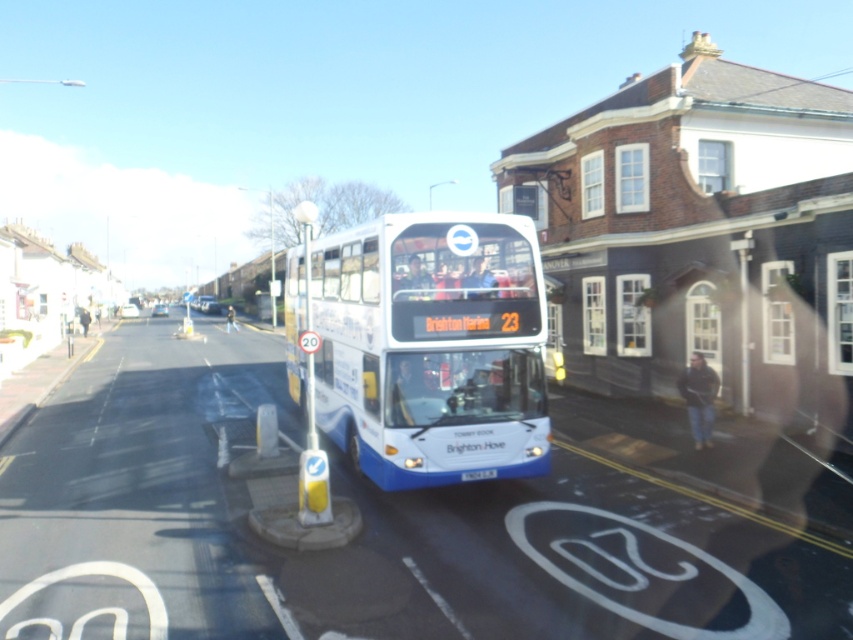
Based on the photo, you are a pedestrian standing on the sidewalk near the two story brick building on the right. You want to read the license plate of the white glossy bus at center. Can you see the white plastic license plate at center clearly from your current position?

The white glossy bus at center is in front of the white plastic license plate at center, so the bus is blocking the view of the license plate. Therefore, you cannot see the white plastic license plate at center clearly from your current position.

You are a delivery person needing to park your 2.5 meter wide van between the white glossy bus at center and the white plastic license plate at center. Can you fit your van there?

The white glossy bus at center might be wider than white plastic license plate at center. Since the van is 2.5 meters wide, it is uncertain if there is enough space between them. The bus could be wider, making the gap too narrow, or it might not be, allowing the van to fit. Without exact measurements, it is risky to attempt parking there.

Consider the image. You are a photographer trying to capture the white glossy bus at center and the white plastic license plate at center in the same frame. Which object should you focus on first if you want to ensure both are in focus?

The white glossy bus at center is larger in size than the white plastic license plate at center, so focusing on the larger object first will help ensure both are in focus.